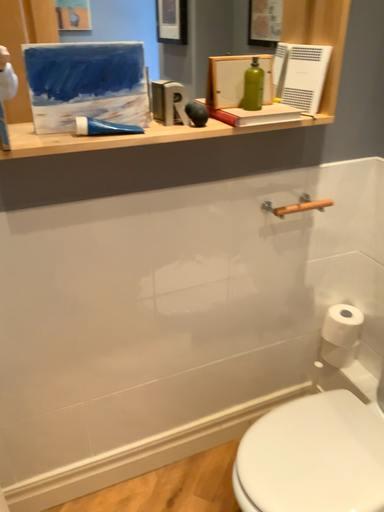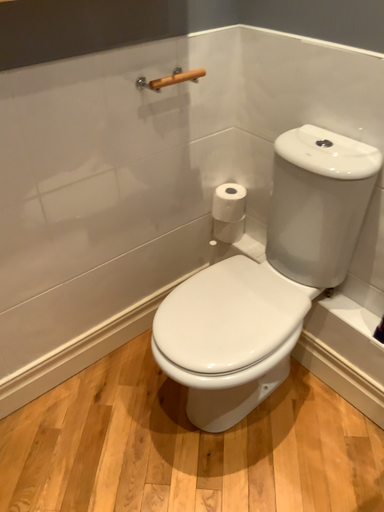
Question: Which way did the camera rotate in the video?

Choices:
 (A) rotated upward
 (B) rotated downward

Answer: (B)